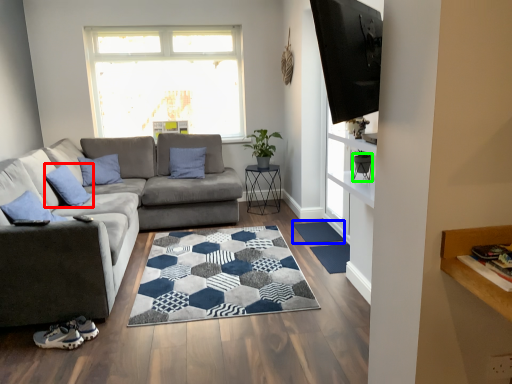
Question: Which object is positioned closest to pillow (highlighted by a red box)? Select from doormat (highlighted by a blue box) and chair (highlighted by a green box).

Choices:
 (A) doormat
 (B) chair

Answer: (A)